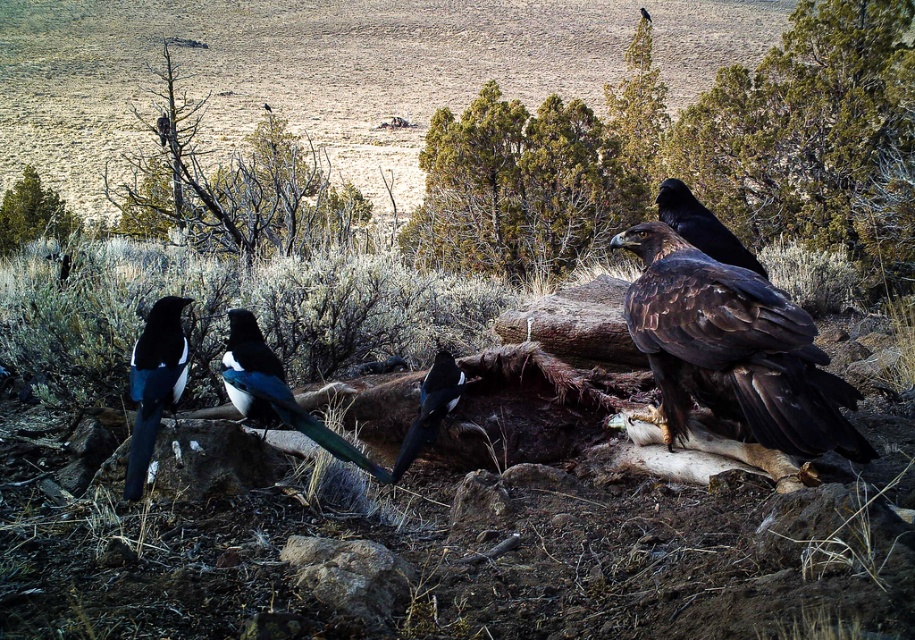
Question: Where is brown wood tree at upper left located in relation to shiny brown vulture at center in the image?

Choices:
 (A) left
 (B) right

Answer: (A)

Question: Among these objects, which one is nearest to the camera?

Choices:
 (A) shiny black vulture at upper right
 (B) black glossy magpie at lower left
 (C) black glossy vulture at center
 (D) shiny brown eagle at center right

Answer: (D)

Question: Where is brown wood tree at upper left located in relation to shiny brown vulture at center in the image?

Choices:
 (A) right
 (B) left

Answer: (B)

Question: Which point is closer to the camera?

Choices:
 (A) green leafy tree at upper left
 (B) shiny brown eagle at center right
 (C) shiny black vulture at upper right
 (D) brown wood tree at upper left

Answer: (B)

Question: Can you confirm if brown wood tree at upper left is positioned to the right of green leafy tree at upper left?

Choices:
 (A) yes
 (B) no

Answer: (A)

Question: Estimate the real-world distances between objects in this image. Which object is farther from the shiny black vulture at upper right?

Choices:
 (A) green leafy tree at upper left
 (B) brown wood tree at upper left
 (C) shiny brown eagle at center right

Answer: (B)